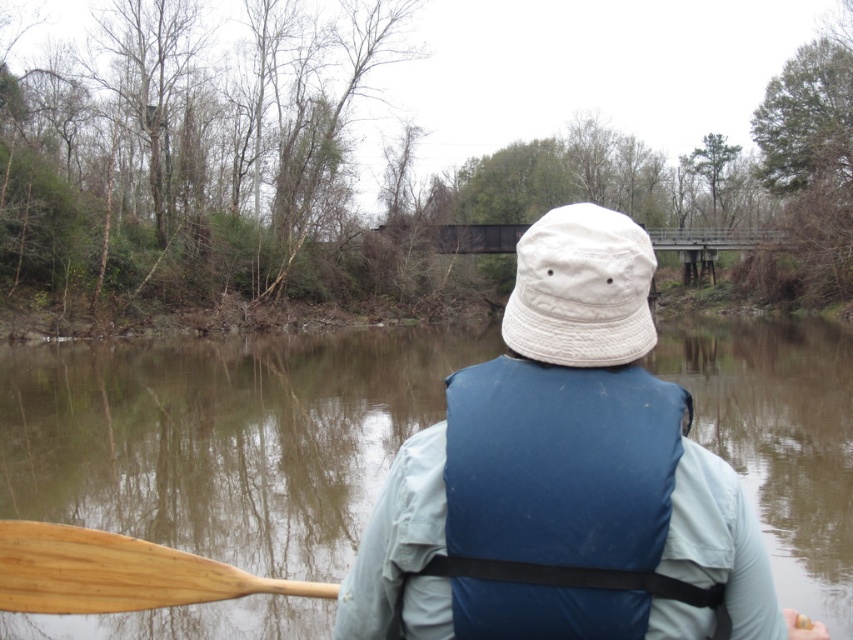
Question: Can you confirm if brown smooth water at center is positioned above white cotton bucket hat at center?

Choices:
 (A) yes
 (B) no

Answer: (B)

Question: Which point appears farthest from the camera in this image?

Choices:
 (A) (582, 285)
 (B) (612, 392)

Answer: (B)

Question: Does brown smooth water at center appear over white cotton bucket hat at center?

Choices:
 (A) yes
 (B) no

Answer: (B)

Question: Is blue fabric life jacket at center further to the viewer compared to white cotton bucket hat at center?

Choices:
 (A) no
 (B) yes

Answer: (A)

Question: Which point is farther to the camera?

Choices:
 (A) white fabric hat at upper center
 (B) brown smooth water at center
 (C) wooden paddle at lower left
 (D) white cotton bucket hat at center

Answer: (C)

Question: Which point is closer to the camera taking this photo?

Choices:
 (A) (280, 589)
 (B) (525, 378)

Answer: (B)